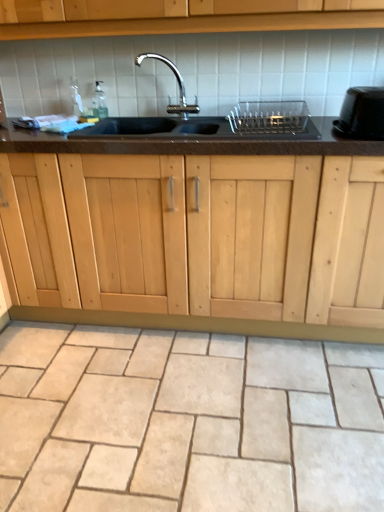
Question: From a real-world perspective, is clear plastic dish rack at center, acting as the second appliance starting from the right, physically below black glossy toaster at right, the 1th appliance viewed from the right?

Choices:
 (A) yes
 (B) no

Answer: (A)

Question: Is clear plastic dish rack at center, acting as the second appliance starting from the right, at the right side of black glossy toaster at right, the second appliance positioned from the left?

Choices:
 (A) yes
 (B) no

Answer: (B)

Question: Is clear plastic dish rack at center, the first appliance positioned from the left, not near black glossy toaster at right, the second appliance positioned from the left?

Choices:
 (A) no
 (B) yes

Answer: (A)

Question: From a real-world perspective, is clear plastic dish rack at center, acting as the second appliance starting from the right, on top of black glossy toaster at right, the 1th appliance viewed from the right?

Choices:
 (A) yes
 (B) no

Answer: (B)

Question: Is clear plastic dish rack at center, acting as the second appliance starting from the right, aimed at black glossy toaster at right, the 1th appliance viewed from the right?

Choices:
 (A) yes
 (B) no

Answer: (B)

Question: Is clear plastic dish rack at center, acting as the second appliance starting from the right, closer to the viewer compared to black glossy toaster at right, the 1th appliance viewed from the right?

Choices:
 (A) yes
 (B) no

Answer: (B)

Question: Is clear plastic dish rack at center, acting as the second appliance starting from the right, positioned before beige stone tile at lower center?

Choices:
 (A) yes
 (B) no

Answer: (B)

Question: From the image's perspective, is clear plastic dish rack at center, acting as the second appliance starting from the right, above beige stone tile at lower center?

Choices:
 (A) yes
 (B) no

Answer: (A)

Question: Is clear plastic dish rack at center, acting as the second appliance starting from the right, looking in the opposite direction of beige stone tile at lower center?

Choices:
 (A) yes
 (B) no

Answer: (B)

Question: Can you confirm if clear plastic dish rack at center, acting as the second appliance starting from the right, is bigger than beige stone tile at lower center?

Choices:
 (A) yes
 (B) no

Answer: (B)

Question: Considering the relative sizes of clear plastic dish rack at center, the first appliance positioned from the left, and beige stone tile at lower center in the image provided, is clear plastic dish rack at center, the first appliance positioned from the left, smaller than beige stone tile at lower center?

Choices:
 (A) no
 (B) yes

Answer: (B)

Question: From the image's perspective, is clear plastic dish rack at center, acting as the second appliance starting from the right, beneath beige stone tile at lower center?

Choices:
 (A) yes
 (B) no

Answer: (B)

Question: Does black granite sink at center have a greater height compared to beige stone tile at lower center?

Choices:
 (A) no
 (B) yes

Answer: (B)